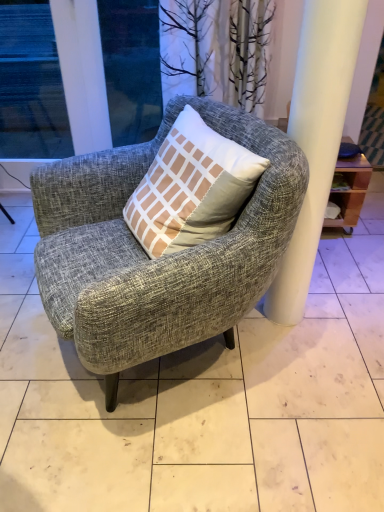
Describe the element at coordinates (31, 84) in the screenshot. This screenshot has height=512, width=384. I see `transparent glass window at upper left, the second window when ordered from right to left` at that location.

The image size is (384, 512). What do you see at coordinates (201, 399) in the screenshot? I see `gray fabric chair at center` at bounding box center [201, 399].

Identify the location of transparent glass window at upper left, which ranks as the 1th window in left-to-right order. The height and width of the screenshot is (512, 384). 31,84.

Considering the points (11, 142) and (138, 30), which point is behind, point (11, 142) or point (138, 30)?

Positioned behind is point (11, 142).

Is transparent glass window at upper left, the second window when ordered from right to left, surrounding transparent glass window at upper left, which is the second window in left-to-right order?

No, transparent glass window at upper left, the second window when ordered from right to left, does not contain transparent glass window at upper left, which is the second window in left-to-right order.

In the scene shown: From a real-world perspective, does transparent glass window at upper left, which ranks as the 1th window in left-to-right order, stand above transparent glass window at upper left, which is the second window in left-to-right order?

No, from a real-world perspective, transparent glass window at upper left, which ranks as the 1th window in left-to-right order, is not above transparent glass window at upper left, which is the second window in left-to-right order.

Between transparent glass window at upper left, which ranks as the 1th window in left-to-right order, and transparent glass window at upper left, positioned as the first window in right-to-left order, which one has smaller width?

transparent glass window at upper left, positioned as the first window in right-to-left order.

In terms of width, does transparent glass window at upper left, positioned as the first window in right-to-left order, look wider or thinner when compared to transparent glass window at upper left, the second window when ordered from right to left?

Clearly, transparent glass window at upper left, positioned as the first window in right-to-left order, has less width compared to transparent glass window at upper left, the second window when ordered from right to left.

Considering the positions of points (50, 100) and (52, 143), is point (50, 100) closer to camera compared to point (52, 143)?

No, it is behind (52, 143).

Considering the sizes of transparent glass window at upper left, which is the second window in left-to-right order, and transparent glass window at upper left, the second window when ordered from right to left, in the image, is transparent glass window at upper left, which is the second window in left-to-right order, bigger or smaller than transparent glass window at upper left, the second window when ordered from right to left,?

In the image, transparent glass window at upper left, which is the second window in left-to-right order, appears to be smaller than transparent glass window at upper left, the second window when ordered from right to left.

Is transparent glass window at upper left, which is the second window in left-to-right order, positioned with its back to transparent glass window at upper left, which ranks as the 1th window in left-to-right order?

No, transparent glass window at upper left, which ranks as the 1th window in left-to-right order, is not at the back of transparent glass window at upper left, which is the second window in left-to-right order.

Considering the sizes of transparent glass window at upper left, positioned as the first window in right-to-left order, and gray fabric chair at center in the image, is transparent glass window at upper left, positioned as the first window in right-to-left order, bigger or smaller than gray fabric chair at center?

In the image, transparent glass window at upper left, positioned as the first window in right-to-left order, appears to be smaller than gray fabric chair at center.

Measure the distance between transparent glass window at upper left, positioned as the first window in right-to-left order, and gray fabric chair at center.

They are 5.31 feet apart.

How different are the orientations of transparent glass window at upper left, which is the second window in left-to-right order, and gray fabric chair at center in degrees?

transparent glass window at upper left, which is the second window in left-to-right order, and gray fabric chair at center are facing 0.973 degrees away from each other.

Considering the positions of points (53, 59) and (378, 421), is point (53, 59) closer to camera compared to point (378, 421)?

No, (53, 59) is behind (378, 421).

Is gray fabric chair at center next to transparent glass window at upper left, the second window when ordered from right to left, and touching it?

There is a gap between gray fabric chair at center and transparent glass window at upper left, the second window when ordered from right to left.

Is point (0, 376) closer to viewer compared to point (48, 134)?

Yes, it is.

From a real-world perspective, is gray fabric chair at center under transparent glass window at upper left, the second window when ordered from right to left?

Yes.

Is gray fabric chair at center located outside transparent glass window at upper left, which ranks as the 1th window in left-to-right order?

gray fabric chair at center is positioned outside transparent glass window at upper left, which ranks as the 1th window in left-to-right order.

Find the location of a particular element. The width and height of the screenshot is (384, 512). window that is the 1st one when counting leftward from the textured gray armchair at center is located at coordinates (31, 84).

Would you say textured gray armchair at center contains transparent glass window at upper left, which is the second window in left-to-right order?

That's incorrect, transparent glass window at upper left, which is the second window in left-to-right order, is not inside textured gray armchair at center.

Looking at this image, from a real-world perspective, does textured gray armchair at center sit lower than transparent glass window at upper left, which is the second window in left-to-right order?

Yes, from a real-world perspective, textured gray armchair at center is under transparent glass window at upper left, which is the second window in left-to-right order.

Is textured gray armchair at center directly adjacent to transparent glass window at upper left, positioned as the first window in right-to-left order?

No.

Would you say transparent glass window at upper left, the second window when ordered from right to left, is inside or outside textured gray armchair at center?

transparent glass window at upper left, the second window when ordered from right to left, is not inside textured gray armchair at center, it's outside.

From a real-world perspective, is transparent glass window at upper left, which ranks as the 1th window in left-to-right order, positioned over textured gray armchair at center based on gravity?

Yes.

Based on the photo, considering the positions of objects transparent glass window at upper left, the second window when ordered from right to left, and textured gray armchair at center in the image provided, who is in front, transparent glass window at upper left, the second window when ordered from right to left, or textured gray armchair at center?

Positioned in front is textured gray armchair at center.

Is transparent glass window at upper left, which ranks as the 1th window in left-to-right order, at the left side of textured gray armchair at center?

Yes, transparent glass window at upper left, which ranks as the 1th window in left-to-right order, is to the left of textured gray armchair at center.

How many degrees apart are the facing directions of textured gray armchair at center and gray fabric chair at center?

textured gray armchair at center and gray fabric chair at center are facing 68.6 degrees away from each other.

Is gray fabric chair at center a part of textured gray armchair at center?

No, gray fabric chair at center is not a part of textured gray armchair at center.

Is textured gray armchair at center bigger than gray fabric chair at center?

Correct, textured gray armchair at center is larger in size than gray fabric chair at center.

Which object is more forward, textured gray armchair at center or gray fabric chair at center?

textured gray armchair at center is more forward.

Where is `window located underneath the transparent glass window at upper left, positioned as the first window in right-to-left order (from a real-world perspective)`? window located underneath the transparent glass window at upper left, positioned as the first window in right-to-left order (from a real-world perspective) is located at coordinates (31, 84).

This screenshot has height=512, width=384. Identify the location of window above the transparent glass window at upper left, which ranks as the 1th window in left-to-right order (from the image's perspective). (31, 84).

Based on their spatial positions, is textured gray armchair at center or transparent glass window at upper left, positioned as the first window in right-to-left order, further from gray fabric chair at center?

transparent glass window at upper left, positioned as the first window in right-to-left order, is positioned further to the anchor gray fabric chair at center.

From the image, which object appears to be nearer to transparent glass window at upper left, positioned as the first window in right-to-left order, textured gray armchair at center or transparent glass window at upper left, which ranks as the 1th window in left-to-right order?

The object closer to transparent glass window at upper left, positioned as the first window in right-to-left order, is transparent glass window at upper left, which ranks as the 1th window in left-to-right order.

Estimate the real-world distances between objects in this image. Which object is further from textured gray armchair at center, gray fabric chair at center or transparent glass window at upper left, which ranks as the 1th window in left-to-right order?

transparent glass window at upper left, which ranks as the 1th window in left-to-right order, is further to textured gray armchair at center.

From the image, which object appears to be nearer to textured gray armchair at center, transparent glass window at upper left, which is the second window in left-to-right order, or gray fabric chair at center?

Among the two, gray fabric chair at center is located nearer to textured gray armchair at center.

Considering their positions, is transparent glass window at upper left, positioned as the first window in right-to-left order, positioned closer to gray fabric chair at center than transparent glass window at upper left, which ranks as the 1th window in left-to-right order?

The object closer to gray fabric chair at center is transparent glass window at upper left, positioned as the first window in right-to-left order.

Looking at the image, which one is located further to textured gray armchair at center, transparent glass window at upper left, positioned as the first window in right-to-left order, or transparent glass window at upper left, which ranks as the 1th window in left-to-right order?

transparent glass window at upper left, which ranks as the 1th window in left-to-right order, lies further to textured gray armchair at center than the other object.

When comparing their distances from gray fabric chair at center, does textured gray armchair at center or transparent glass window at upper left, which ranks as the 1th window in left-to-right order, seem closer?

textured gray armchair at center is positioned closer to the anchor gray fabric chair at center.

Considering their positions, is transparent glass window at upper left, positioned as the first window in right-to-left order, positioned further to gray fabric chair at center than textured gray armchair at center?

transparent glass window at upper left, positioned as the first window in right-to-left order, lies further to gray fabric chair at center than the other object.

Image resolution: width=384 pixels, height=512 pixels. Identify the location of window between textured gray armchair at center and transparent glass window at upper left, positioned as the first window in right-to-left order, from front to back. (31, 84).

Locate an element on the screen. The width and height of the screenshot is (384, 512). tile between textured gray armchair at center and transparent glass window at upper left, the second window when ordered from right to left, in the front-back direction is located at coordinates (201, 399).

Locate an element on the screen. The image size is (384, 512). tile between textured gray armchair at center and transparent glass window at upper left, which is the second window in left-to-right order, in the front-back direction is located at coordinates click(x=201, y=399).

Image resolution: width=384 pixels, height=512 pixels. Identify the location of window between transparent glass window at upper left, positioned as the first window in right-to-left order, and gray fabric chair at center vertically. (31, 84).